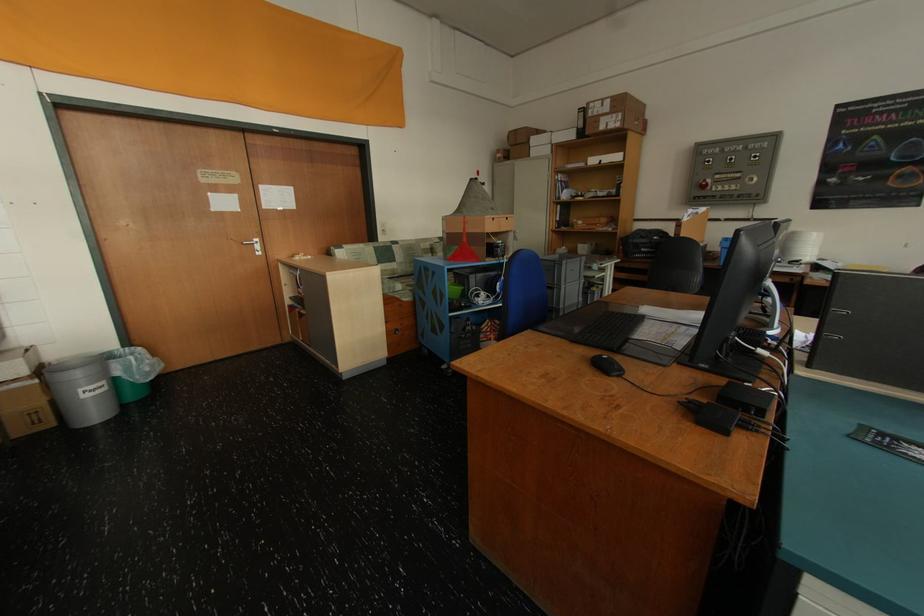
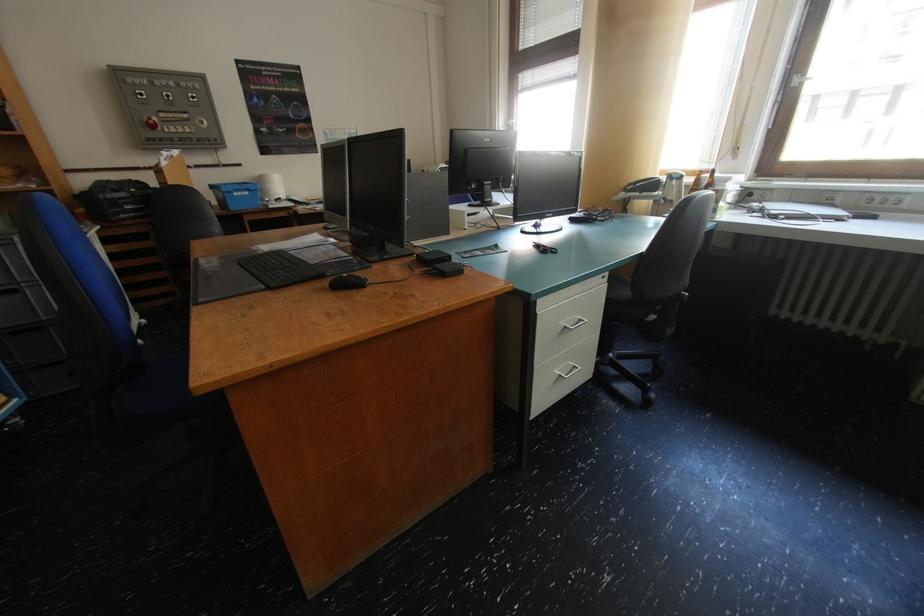
The images are taken continuously from a first-person perspective. In which direction is your viewpoint rotating?

The camera's rotation is toward right-down.